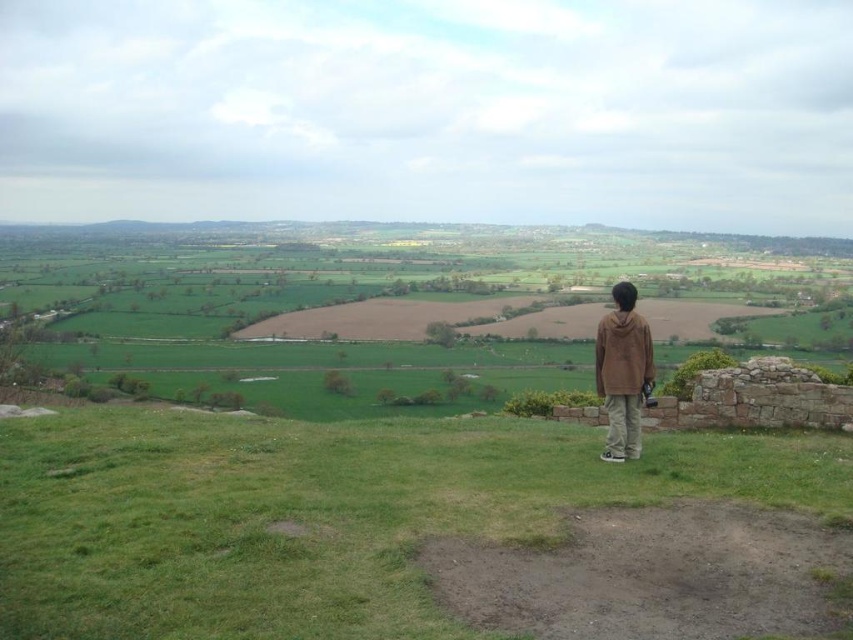
Question: Does green grassy at center appear under brown cotton hoodie at center?

Choices:
 (A) yes
 (B) no

Answer: (A)

Question: Is green grassy at center positioned at the back of brown cotton hoodie at center?

Choices:
 (A) yes
 (B) no

Answer: (B)

Question: Is green grassy at center bigger than brown cotton hoodie at center?

Choices:
 (A) no
 (B) yes

Answer: (B)

Question: Among these points, which one is farthest from the camera?

Choices:
 (A) (424, 586)
 (B) (624, 310)

Answer: (B)

Question: Which point is closer to the camera?

Choices:
 (A) (612, 364)
 (B) (209, 452)

Answer: (B)